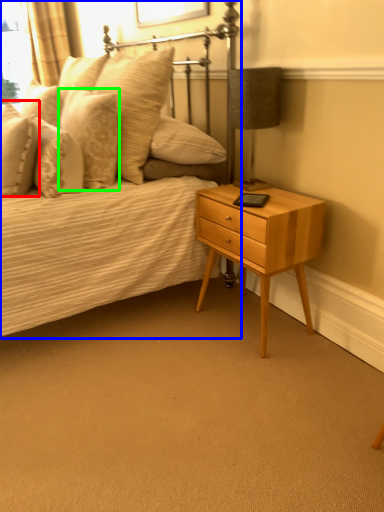
Question: Which object is the farthest from pillow (highlighted by a red box)? Choose among these: bed (highlighted by a blue box) or pillow (highlighted by a green box).

Choices:
 (A) bed
 (B) pillow

Answer: (A)